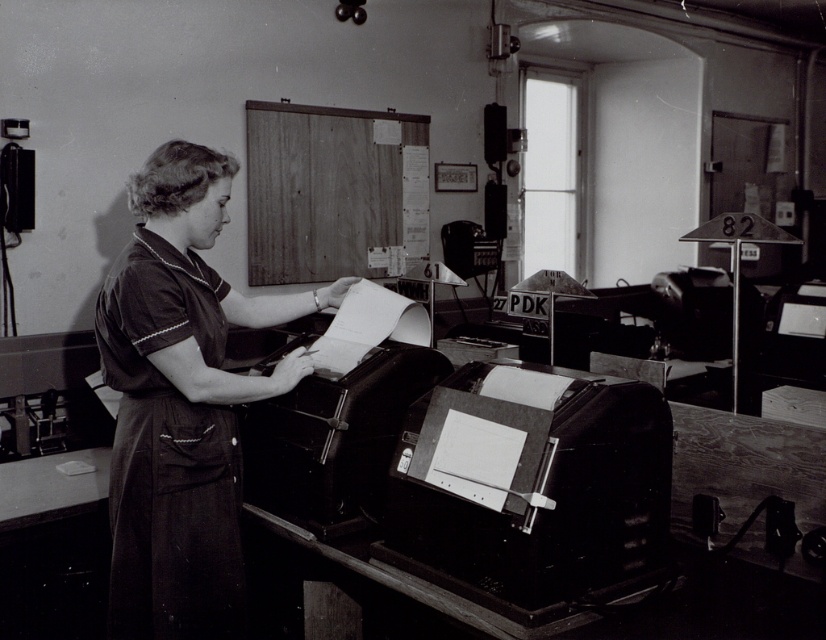
You are an office worker in the 1950s who needs to print a document. You see the metallic black printer at lower center and the metallic paper at center. Which object is closer to you?

The metallic black printer at lower center is closer to you because it is in front of the metallic paper at center.

What are the coordinates of the metallic black printer at lower center?

The coordinates of the metallic black printer at lower center are at point (532, 490).

You are an office worker in this scene and need to make space for a new file folder. Which object should you move to free up more space, the metallic black printer at lower center or the metallic paper at center?

You should move the metallic paper at center because it occupies more space than the metallic black printer at lower center.